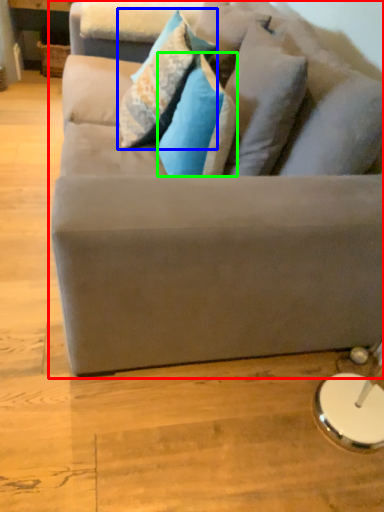
Question: Based on their relative distances, which object is farther from studio couch (highlighted by a red box)? Choose from pillow (highlighted by a blue box) and pillow (highlighted by a green box).

Choices:
 (A) pillow
 (B) pillow

Answer: (A)